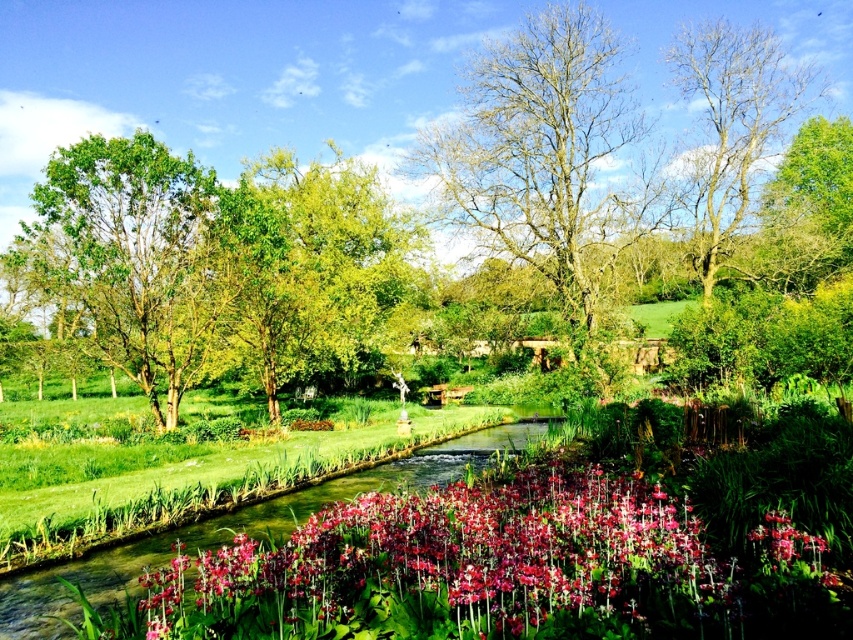
You are a gardener who wants to plant a new tree that needs full sunlight. You see the pink glossy flowers at center and the bare wood tree at upper right in the scene. Which object is taller, and why does that matter for choosing the planting location?

The bare wood tree at upper right is taller than the pink glossy flowers at center. Since the new tree requires full sunlight, planting it near the taller bare wood tree might block sunlight, so choose a spot away from it to ensure adequate light.

You are standing at the edge of the stream and notice the bare wood tree at upper right and the pink glossy flower at center. From your perspective, which object is positioned to the right side?

The bare wood tree at upper right is positioned to the right of the pink glossy flower at center, so it is the one on the right side.